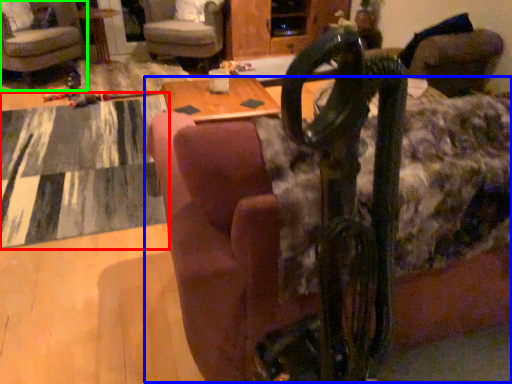
Question: Which object is the closest to the mat (highlighted by a red box)? Choose among these: couch (highlighted by a blue box) or chair (highlighted by a green box).

Choices:
 (A) couch
 (B) chair

Answer: (B)